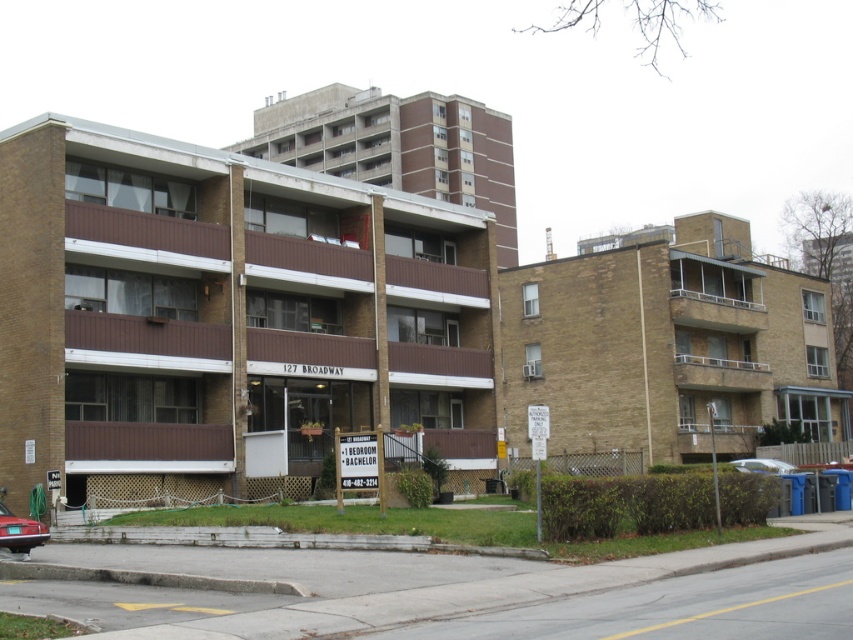
You are a delivery person trying to park your van between the shiny red sedan at lower left and the white glossy sedan at lower right. Can you fit your van, which is 2 meters wide, in the space between them?

A: The shiny red sedan at lower left is closer to the viewer than the white glossy sedan at lower right. Therefore, the distance between them cannot be determined based on the given information, so it is unclear if the van can fit.

Consider the image. You are a delivery driver approaching the apartment complex and need to park your vehicle. You see a shiny red sedan at lower left and a white glossy sedan at lower right. Which parking spot is higher in elevation?

The shiny red sedan at lower left is located above the white glossy sedan at lower right, so the parking spot for the shiny red sedan at lower left is higher in elevation.

You are a delivery driver who needs to park your vehicle in the residential area shown. You have a white glossy sedan at lower right and a shiny red sedan at lower left. Which vehicle would require more parking space due to its size?

The white glossy sedan at lower right requires more parking space because it is larger than the shiny red sedan at lower left.